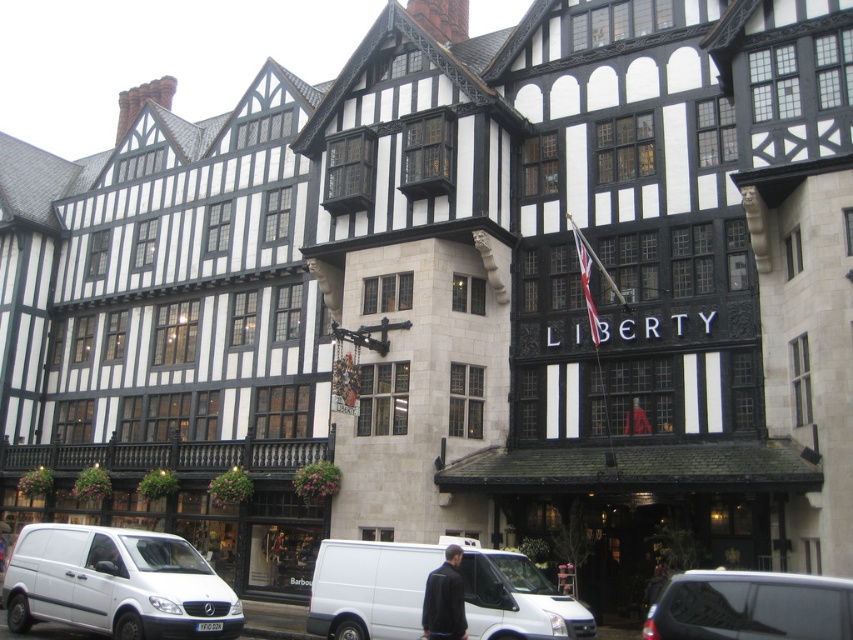
Question: Is white matte van at lower left below dark blue jacket at center?

Choices:
 (A) no
 (B) yes

Answer: (B)

Question: Which point is closer to the camera?

Choices:
 (A) metallic silver van at center
 (B) dark blue jacket at center
 (C) white matte van at center
 (D) white matte van at lower left

Answer: (A)

Question: Where is white matte van at lower left located in relation to white matte van at center in the image?

Choices:
 (A) right
 (B) left

Answer: (B)

Question: Which point is farther to the camera?

Choices:
 (A) white matte van at lower left
 (B) dark blue jacket at center
 (C) metallic silver van at center
 (D) white matte van at center

Answer: (A)

Question: Which object is the closest to the white matte van at lower left?

Choices:
 (A) white matte van at center
 (B) dark blue jacket at center

Answer: (A)

Question: Can you confirm if white matte van at lower left is positioned below metallic silver van at center?

Choices:
 (A) no
 (B) yes

Answer: (B)